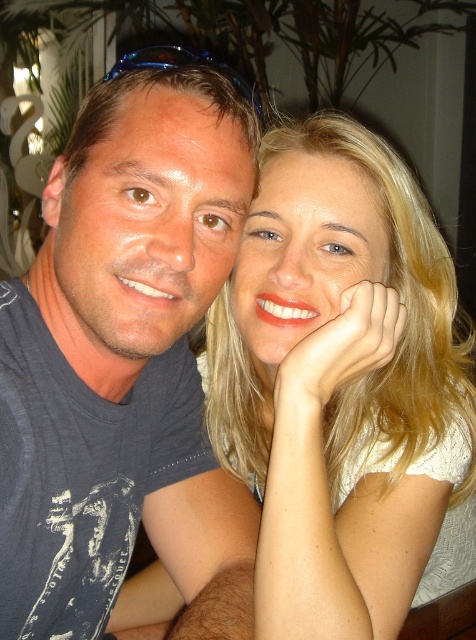
Question: Which point appears farthest from the camera in this image?

Choices:
 (A) (139, 106)
 (B) (474, 392)

Answer: (B)

Question: Which point is farther to the camera?

Choices:
 (A) smooth blonde hair at center
 (B) dark blue t-shirt at left

Answer: (A)

Question: Does dark blue t-shirt at left appear under smooth blonde hair at center?

Choices:
 (A) no
 (B) yes

Answer: (B)

Question: Which of the following is the closest to the observer?

Choices:
 (A) dark blue t-shirt at left
 (B) smooth blonde hair at center

Answer: (A)

Question: Is the position of dark blue t-shirt at left more distant than that of smooth blonde hair at center?

Choices:
 (A) yes
 (B) no

Answer: (B)

Question: Does dark blue t-shirt at left appear under smooth blonde hair at center?

Choices:
 (A) yes
 (B) no

Answer: (A)